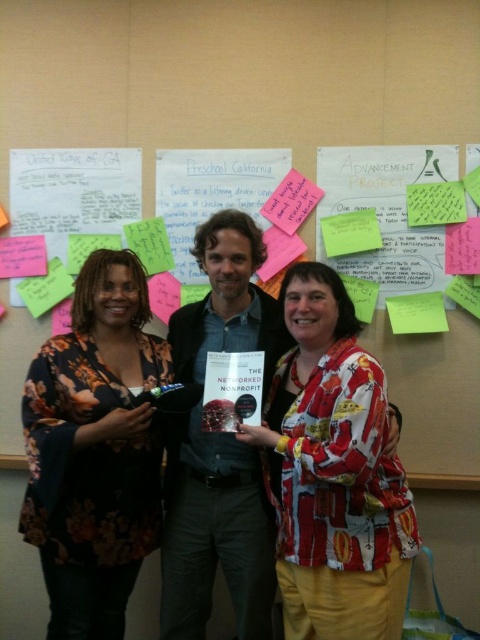
Is point (100, 433) more distant than point (439, 483)?

No, (100, 433) is closer to viewer.

Is point (99, 605) positioned in front of point (12, 458)?

Yes, point (99, 605) is in front of point (12, 458).

Is point (84, 529) positioned after point (16, 461)?

No, (84, 529) is in front of (16, 461).

You are a GUI agent. You are given a task and a screenshot of the screen. Output one action in this format:
    pyautogui.click(x=<x>, y=<y>)
    Task: Click on the floral print blouse at left
    The image size is (480, 640).
    Given the screenshot: What is the action you would take?
    pyautogui.click(x=95, y=449)

Is printed fabric shirt at center shorter than floral print blouse at left?

Yes, printed fabric shirt at center is shorter than floral print blouse at left.

Find the location of `printed fabric shirt at center`. printed fabric shirt at center is located at coordinates (333, 472).

Where is `printed fabric shirt at center`? This screenshot has height=640, width=480. printed fabric shirt at center is located at coordinates (333, 472).

Does point (277, 508) come in front of point (474, 476)?

Yes, it is.

Can you confirm if printed fabric shirt at center is bigger than white paper notes at upper center?

Indeed, printed fabric shirt at center has a larger size compared to white paper notes at upper center.

Is point (312, 625) farther from camera compared to point (4, 458)?

No, (312, 625) is in front of (4, 458).

Where is `printed fabric shirt at center`? printed fabric shirt at center is located at coordinates point(333,472).